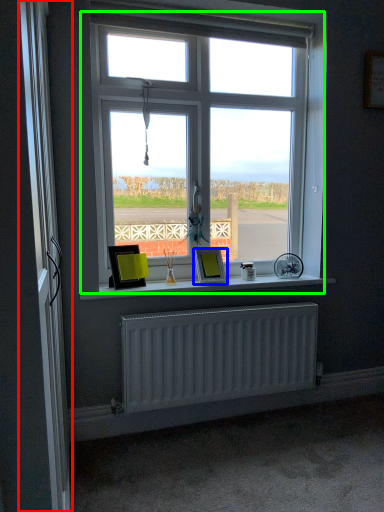
Question: Which is nearer to the screen door (highlighted by a red box)? picture frame (highlighted by a blue box) or window (highlighted by a green box).

Choices:
 (A) picture frame
 (B) window

Answer: (A)